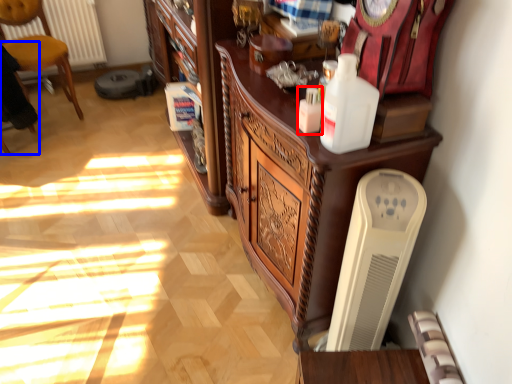
Question: Among these objects, which one is nearest to the camera, bottle (highlighted by a red box) or armchair (highlighted by a blue box)?

Choices:
 (A) bottle
 (B) armchair

Answer: (A)